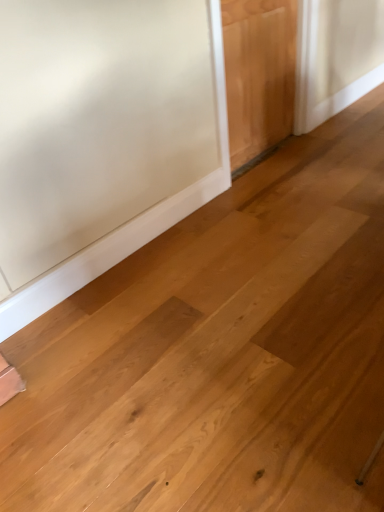
Find the location of a particular element. The height and width of the screenshot is (512, 384). light wood door at center is located at coordinates (258, 74).

The width and height of the screenshot is (384, 512). Describe the element at coordinates (258, 74) in the screenshot. I see `light wood door at center` at that location.

You are a GUI agent. You are given a task and a screenshot of the screen. Output one action in this format:
    pyautogui.click(x=<x>, y=<y>)
    Task: Click on the light wood door at center
    
    Given the screenshot: What is the action you would take?
    pyautogui.click(x=258, y=74)